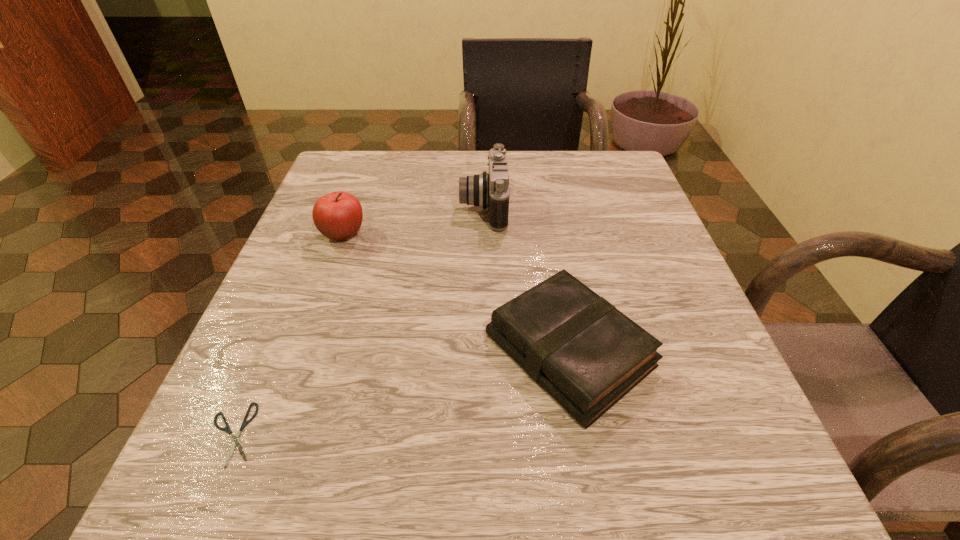
Find the location of a particular element. The height and width of the screenshot is (540, 960). camera is located at coordinates (485, 190).

This screenshot has width=960, height=540. Identify the location of apple. (338, 215).

This screenshot has width=960, height=540. Identify the location of book. pos(585,353).

The width and height of the screenshot is (960, 540). I want to click on shears, so click(227, 429).

Where is `vacant space located 0.220m on the front-facing side of the camera`? The image size is (960, 540). vacant space located 0.220m on the front-facing side of the camera is located at coordinates (358, 207).

I want to click on vacant space located on the front-facing side of the camera, so click(x=325, y=207).

Identify the location of free location located on the front-facing side of the camera. (423, 207).

The width and height of the screenshot is (960, 540). Identify the location of vacant space situated 0.330m on the right of the apple. (532, 234).

I want to click on free location located on the back of the second shortest object, so click(544, 212).

At what (x,y) coordinates should I click in order to perform the action: click on vacant position located 0.180m on the back of the shortest object. Please return your answer as a coordinate pair (x, y). Looking at the image, I should click on (287, 307).